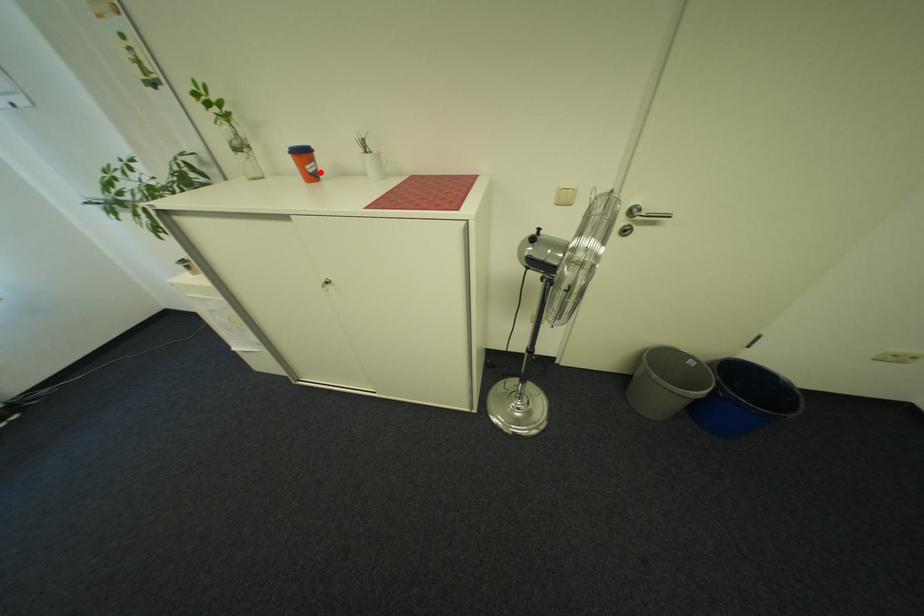
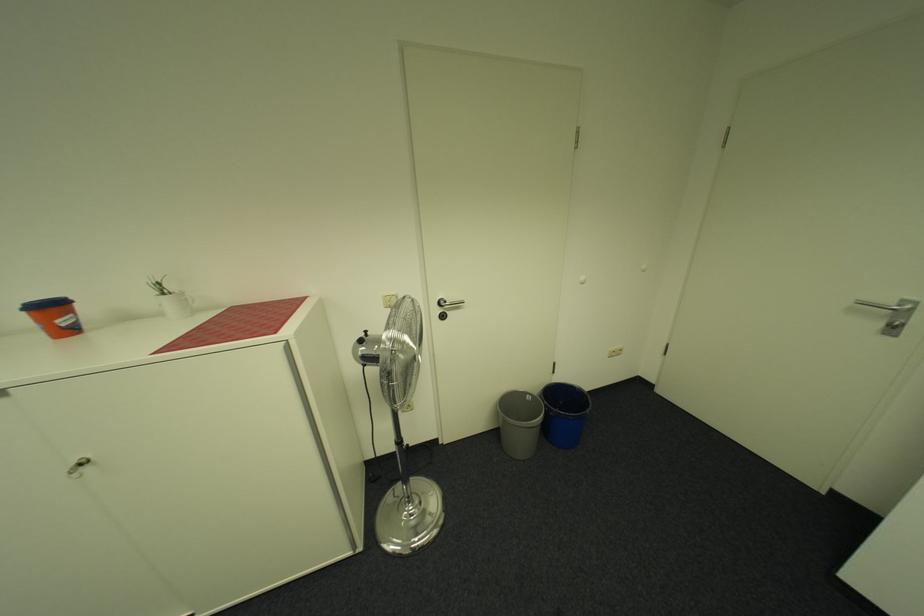
In the second image, find the point that corresponds to the highlighted location in the first image.

(73, 326)